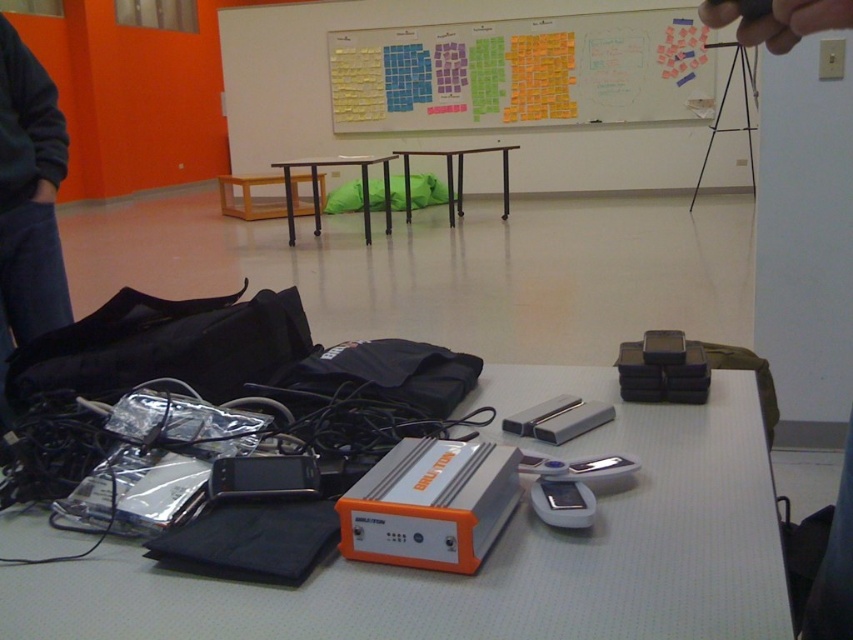
Question: Which point appears farthest from the camera in this image?

Choices:
 (A) (838, 8)
 (B) (288, 164)
 (C) (578, 65)
 (D) (529, 518)

Answer: (C)

Question: Which point appears farthest from the camera in this image?

Choices:
 (A) (724, 8)
 (B) (746, 96)

Answer: (B)

Question: Where is orange plastic device at center located in relation to metallic gray table at center in the image?

Choices:
 (A) above
 (B) below

Answer: (B)

Question: Estimate the real-world distances between objects in this image. Which object is closer to the colorful sticky notes at upper center?

Choices:
 (A) metallic gray table at center
 (B) metallic silver tripod at upper right
 (C) dark blue jeans at lower left

Answer: (A)

Question: Does metallic silver tripod at upper right come in front of metallic gray table at center?

Choices:
 (A) no
 (B) yes

Answer: (A)

Question: Does colorful sticky notes at upper center have a smaller size compared to dark blue jeans at lower left?

Choices:
 (A) no
 (B) yes

Answer: (A)